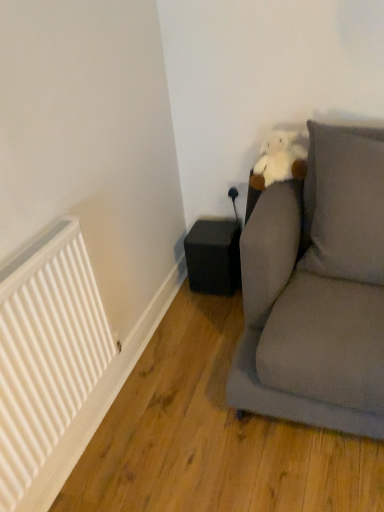
Question: Is white matte radiator at left completely or partially outside of gray fabric pillow at upper right?

Choices:
 (A) yes
 (B) no

Answer: (A)

Question: Is white matte radiator at left beside gray fabric pillow at upper right?

Choices:
 (A) no
 (B) yes

Answer: (A)

Question: From a real-world perspective, is white matte radiator at left physically below gray fabric pillow at upper right?

Choices:
 (A) yes
 (B) no

Answer: (A)

Question: Can you confirm if white matte radiator at left is thinner than gray fabric pillow at upper right?

Choices:
 (A) no
 (B) yes

Answer: (B)

Question: From the image's perspective, would you say white matte radiator at left is shown under gray fabric pillow at upper right?

Choices:
 (A) no
 (B) yes

Answer: (B)

Question: Is black matte speaker at lower center situated inside gray fabric pillow at upper right or outside?

Choices:
 (A) inside
 (B) outside

Answer: (B)

Question: Based on their sizes in the image, would you say black matte speaker at lower center is bigger or smaller than gray fabric pillow at upper right?

Choices:
 (A) big
 (B) small

Answer: (B)

Question: In terms of width, does black matte speaker at lower center look wider or thinner when compared to gray fabric pillow at upper right?

Choices:
 (A) thin
 (B) wide

Answer: (B)

Question: Visually, is black matte speaker at lower center positioned to the left or to the right of gray fabric pillow at upper right?

Choices:
 (A) left
 (B) right

Answer: (A)

Question: Considering their positions, is white matte radiator at left located in front of or behind black matte speaker at lower center?

Choices:
 (A) front
 (B) behind

Answer: (A)

Question: From the image's perspective, is white matte radiator at left positioned above or below black matte speaker at lower center?

Choices:
 (A) above
 (B) below

Answer: (B)

Question: Considering the positions of white matte radiator at left and black matte speaker at lower center in the image, is white matte radiator at left bigger or smaller than black matte speaker at lower center?

Choices:
 (A) big
 (B) small

Answer: (A)

Question: Is white matte radiator at left wider or thinner than black matte speaker at lower center?

Choices:
 (A) thin
 (B) wide

Answer: (A)

Question: Considering their positions, is black matte speaker at lower center located in front of or behind white matte radiator at left?

Choices:
 (A) front
 (B) behind

Answer: (B)

Question: From their relative heights in the image, would you say black matte speaker at lower center is taller or shorter than white matte radiator at left?

Choices:
 (A) short
 (B) tall

Answer: (A)